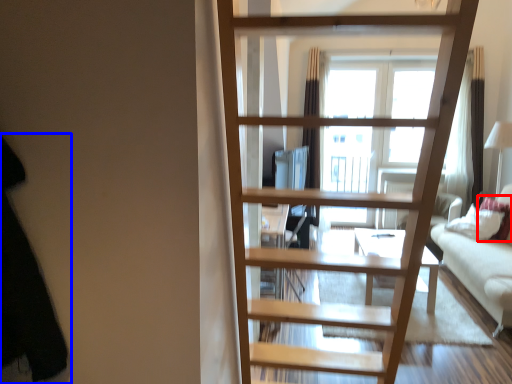
Question: Which object is closer to the camera taking this photo, pillow (highlighted by a red box) or dark (highlighted by a blue box)?

Choices:
 (A) pillow
 (B) dark

Answer: (B)